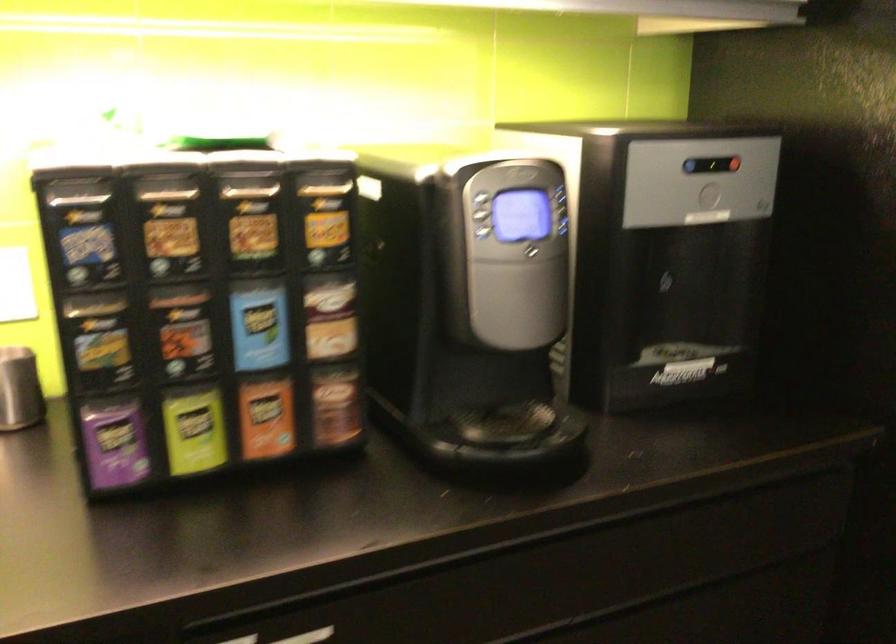
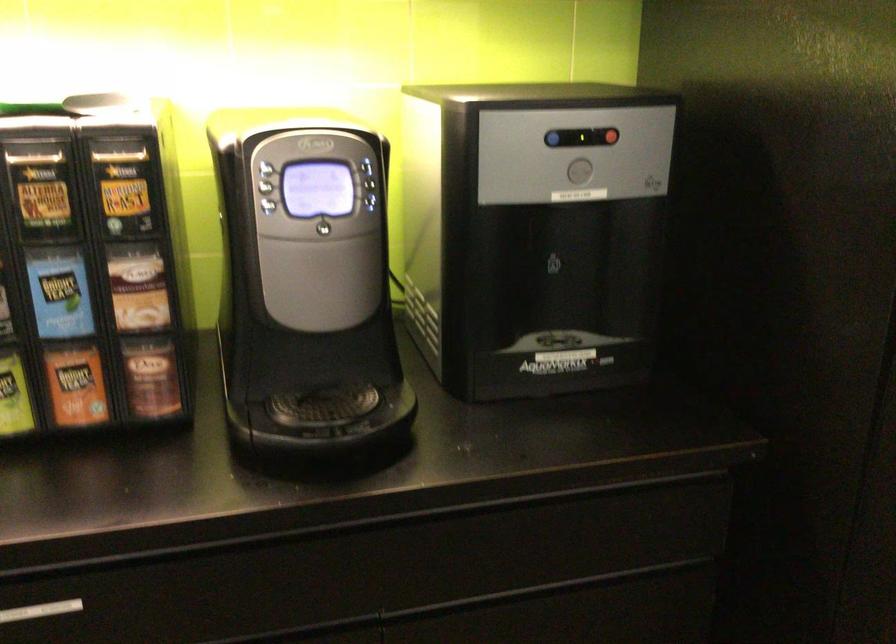
Where in the second image is the point corresponding to point (256, 327) from the first image?

(58, 292)